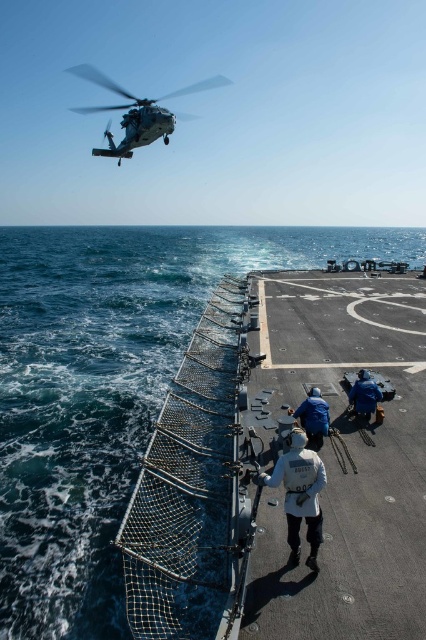
Which is behind, point (132, 113) or point (316, 426)?

The point (132, 113) is behind.

Does metallic gray helicopter at upper center have a smaller size compared to blue fabric jacket at center?

No, metallic gray helicopter at upper center is not smaller than blue fabric jacket at center.

Which is in front, point (124, 116) or point (310, 412)?

Point (310, 412) is more forward.

Where is `metallic gray helicopter at upper center`? metallic gray helicopter at upper center is located at coordinates (137, 113).

Who is lower down, blue fabric jacket at center or blue fabric jacket at lower right?

blue fabric jacket at center is below.

Based on the photo, can you confirm if blue fabric jacket at center is smaller than blue fabric jacket at lower right?

Yes.

Between point (313, 416) and point (373, 406), which one is positioned in front?

Positioned in front is point (313, 416).

The height and width of the screenshot is (640, 426). What are the coordinates of `blue fabric jacket at center` in the screenshot? It's located at (313, 417).

Between point (178, 244) and point (348, 397), which one is positioned in front?

Point (348, 397)

Is blue water at lower left to the right of blue fabric jacket at lower right from the viewer's perspective?

No, blue water at lower left is not to the right of blue fabric jacket at lower right.

Between point (241, 264) and point (360, 371), which one is positioned in front?

Point (360, 371)

Find the location of `blue water at lower left`. blue water at lower left is located at coordinates (101, 374).